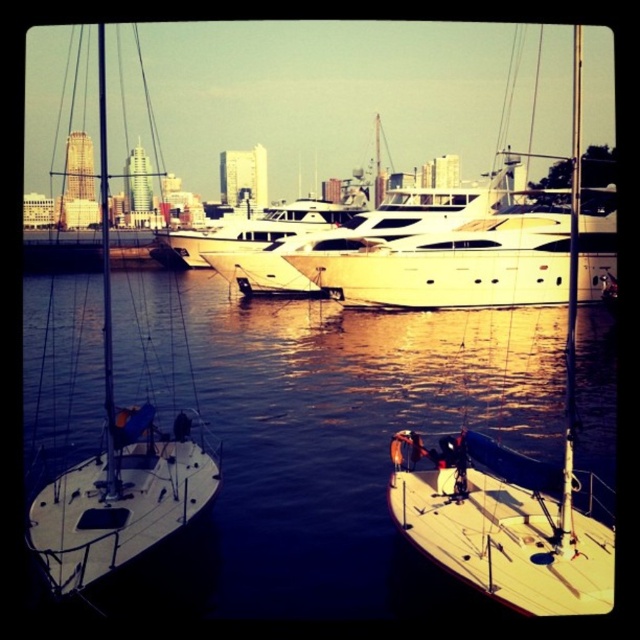
Question: Is white matte sailboat at lower right above white glossy yacht at center?

Choices:
 (A) no
 (B) yes

Answer: (B)

Question: Which object appears closest to the camera in this image?

Choices:
 (A) white matte sailboat at lower right
 (B) wooden sailboat at center

Answer: (B)

Question: Is wooden sailboat at center to the left of white glossy yacht at center from the viewer's perspective?

Choices:
 (A) no
 (B) yes

Answer: (B)

Question: Which of the following is the closest to the observer?

Choices:
 (A) white glossy yacht at center
 (B) white glossy water at center

Answer: (B)

Question: Which of the following is the farthest from the observer?

Choices:
 (A) white glossy yacht at center
 (B) wooden sailboat at center

Answer: (A)

Question: Can you confirm if white glossy water at center is positioned to the left of wooden sailboat at center?

Choices:
 (A) yes
 (B) no

Answer: (A)